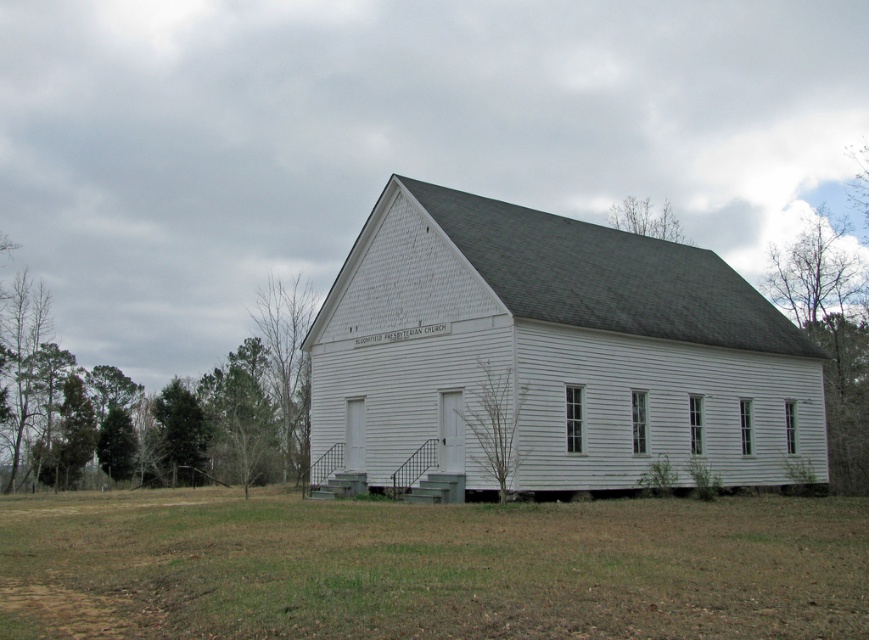
Can you confirm if white wood barn at center is wider than bare branches at upper center?

Correct, the width of white wood barn at center exceeds that of bare branches at upper center.

Is white wood barn at center to the right of bare branches at upper center from the viewer's perspective?

In fact, white wood barn at center is to the left of bare branches at upper center.

Is point (313, 465) positioned in front of point (673, 241)?

That is True.

Identify the location of white wood barn at center. tap(552, 352).

Is point (283, 352) less distant than point (190, 408)?

No.

Is bare branches at left below green leafy tree at left?

No, bare branches at left is not below green leafy tree at left.

Between point (308, 312) and point (163, 452), which one is positioned behind?

The point (308, 312) is more distant.

Identify the location of bare branches at left. pos(287,364).

Does point (775, 496) come in front of point (622, 216)?

Yes.

Who is more forward, (108, 512) or (621, 204)?

Point (108, 512) is more forward.

Locate an element on the screen. This screenshot has height=640, width=869. brown grass at lower center is located at coordinates (428, 566).